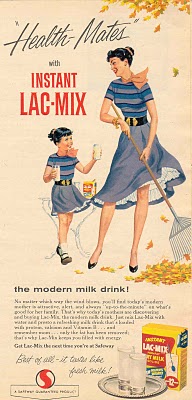
Locate an element on the screen. This screenshot has height=400, width=192. poster is located at coordinates (122, 75).